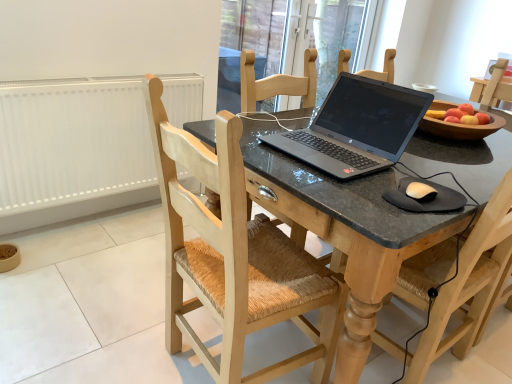
This screenshot has height=384, width=512. Find the location of `vacant space in front of black rubber mousepad at lower right`. vacant space in front of black rubber mousepad at lower right is located at coordinates (411, 222).